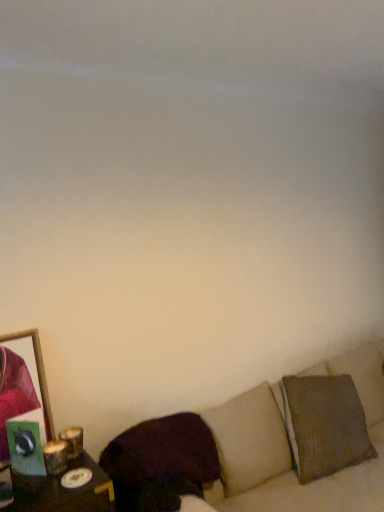
Question: From a real-world perspective, is dark brown fabric pillow at lower center beneath textured beige couch at lower right?

Choices:
 (A) yes
 (B) no

Answer: (B)

Question: Can you confirm if dark brown fabric pillow at lower center is taller than textured beige couch at lower right?

Choices:
 (A) no
 (B) yes

Answer: (A)

Question: Does dark brown fabric pillow at lower center have a greater width compared to textured beige couch at lower right?

Choices:
 (A) yes
 (B) no

Answer: (B)

Question: Is there a large distance between dark brown fabric pillow at lower center and textured beige couch at lower right?

Choices:
 (A) yes
 (B) no

Answer: (B)

Question: Is textured beige couch at lower right at the back of dark brown fabric pillow at lower center?

Choices:
 (A) no
 (B) yes

Answer: (B)

Question: Does dark brown fabric pillow at lower center have a lesser height compared to textured beige couch at lower right?

Choices:
 (A) no
 (B) yes

Answer: (B)

Question: Is textured beige couch at lower right turned away from wooden frame at left?

Choices:
 (A) no
 (B) yes

Answer: (A)

Question: Are textured beige couch at lower right and wooden frame at left beside each other?

Choices:
 (A) yes
 (B) no

Answer: (B)

Question: Considering the relative sizes of textured beige couch at lower right and wooden frame at left in the image provided, is textured beige couch at lower right wider than wooden frame at left?

Choices:
 (A) no
 (B) yes

Answer: (B)

Question: Is wooden frame at left located within textured beige couch at lower right?

Choices:
 (A) yes
 (B) no

Answer: (B)

Question: Is textured beige couch at lower right not within wooden frame at left?

Choices:
 (A) no
 (B) yes

Answer: (B)

Question: Is textured beige couch at lower right to the left of wooden frame at left from the viewer's perspective?

Choices:
 (A) yes
 (B) no

Answer: (B)

Question: From the image's perspective, is textured beige couch at lower right located above dark brown fabric pillow at lower center?

Choices:
 (A) no
 (B) yes

Answer: (A)